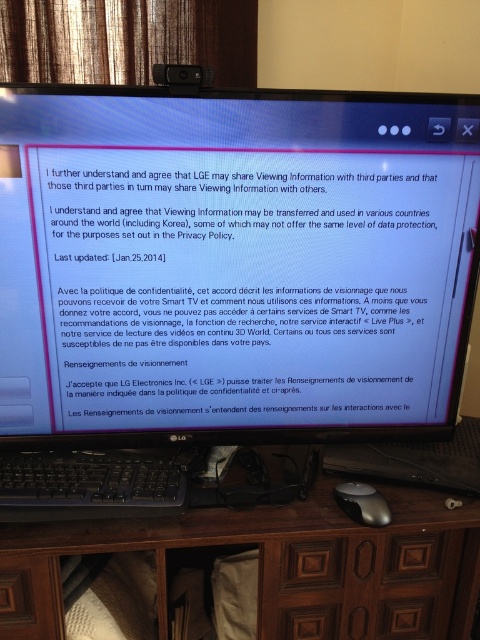
You are a photographer adjusting your camera to capture the scene on the desk. You notice two points marked on the image at coordinates point [189,337] and point [301,637]. Which point should you focus on first if you want to ensure both points are in sharp focus?

You should focus on point [189,337] first because it is closer to the camera than point [301,637]. By focusing on the closer point, the farther point may still be within the depth of field, ensuring both are sharp.

You are a user trying to read the white paper at center on the desk. Can you reach it without moving the brown wood computer desk at center?

The white paper at center is closer to the viewer than the brown wood computer desk at center, so yes, you can reach it without moving the desk.